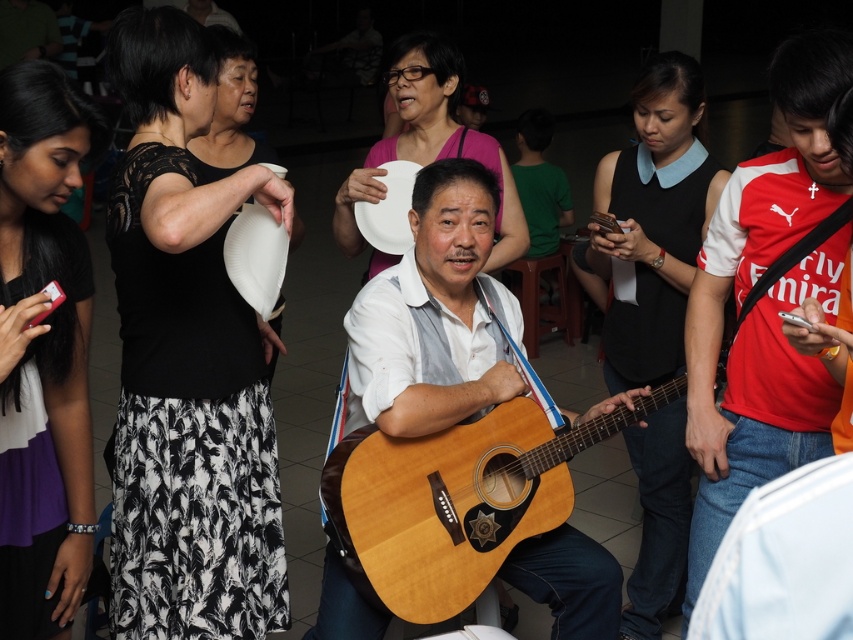
Who is positioned more to the left, red jersey at right or black matte shirt at center?

From the viewer's perspective, black matte shirt at center appears more on the left side.

Which is below, red jersey at right or black matte shirt at center?

red jersey at right is below.

Locate an element on the screen. red jersey at right is located at coordinates coord(767,301).

Who is taller, purple fabric phone at left or black matte shirt at center?

With more height is black matte shirt at center.

Describe the element at coordinates (42, 355) in the screenshot. I see `purple fabric phone at left` at that location.

This screenshot has width=853, height=640. I want to click on purple fabric phone at left, so click(x=42, y=355).

Between black lace top at upper left and black matte shirt at center, which one is positioned higher?

Positioned higher is black lace top at upper left.

Is point (262, 337) more distant than point (643, 630)?

No, it is not.

You are a GUI agent. You are given a task and a screenshot of the screen. Output one action in this format:
    pyautogui.click(x=<x>, y=<y>)
    Task: Click on the black lace top at upper left
    This screenshot has width=853, height=640.
    Given the screenshot: What is the action you would take?
    pyautogui.click(x=187, y=358)